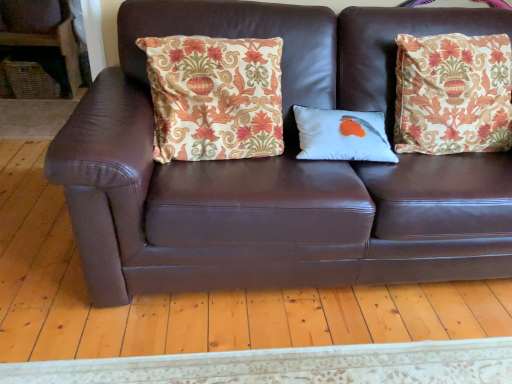
Question: Which direction should I rotate to look at white matte pillow with bird design at center, acting as the first pillow starting from the right, — up or down?

Choices:
 (A) down
 (B) up

Answer: (B)

Question: Can you confirm if brown leather couch at center is wider than white matte pillow with bird design at center, acting as the first pillow starting from the right?

Choices:
 (A) yes
 (B) no

Answer: (A)

Question: Is brown leather couch at center further to camera compared to white matte pillow with bird design at center, which is counted as the second pillow, starting from the left?

Choices:
 (A) yes
 (B) no

Answer: (B)

Question: From the image's perspective, is brown leather couch at center above white matte pillow with bird design at center, which is counted as the second pillow, starting from the left?

Choices:
 (A) yes
 (B) no

Answer: (B)

Question: From a real-world perspective, is brown leather couch at center over white matte pillow with bird design at center, which is counted as the second pillow, starting from the left?

Choices:
 (A) no
 (B) yes

Answer: (A)

Question: Can white matte pillow with bird design at center, acting as the first pillow starting from the right, be found inside brown leather couch at center?

Choices:
 (A) no
 (B) yes

Answer: (B)

Question: Is brown leather couch at center placed right next to white matte pillow with bird design at center, which is counted as the second pillow, starting from the left?

Choices:
 (A) yes
 (B) no

Answer: (B)

Question: Is white matte pillow with bird design at center, acting as the first pillow starting from the right, facing away from brown leather couch at center?

Choices:
 (A) yes
 (B) no

Answer: (A)

Question: From a real-world perspective, is white matte pillow with bird design at center, which is counted as the second pillow, starting from the left, physically above brown leather couch at center?

Choices:
 (A) yes
 (B) no

Answer: (A)

Question: Is white matte pillow with bird design at center, which is counted as the second pillow, starting from the left, shorter than brown leather couch at center?

Choices:
 (A) no
 (B) yes

Answer: (B)

Question: Considering the relative sizes of white matte pillow with bird design at center, acting as the first pillow starting from the right, and brown leather couch at center in the image provided, is white matte pillow with bird design at center, acting as the first pillow starting from the right, smaller than brown leather couch at center?

Choices:
 (A) yes
 (B) no

Answer: (A)

Question: Considering the relative sizes of white matte pillow with bird design at center, which is counted as the second pillow, starting from the left, and brown leather couch at center in the image provided, is white matte pillow with bird design at center, which is counted as the second pillow, starting from the left, wider than brown leather couch at center?

Choices:
 (A) no
 (B) yes

Answer: (A)

Question: Is white matte pillow with bird design at center, which is counted as the second pillow, starting from the left, at the left side of brown leather couch at center?

Choices:
 (A) no
 (B) yes

Answer: (B)

Question: Is patterned fabric pillow at center, the first pillow from the left, aimed at brown leather couch at center?

Choices:
 (A) no
 (B) yes

Answer: (B)